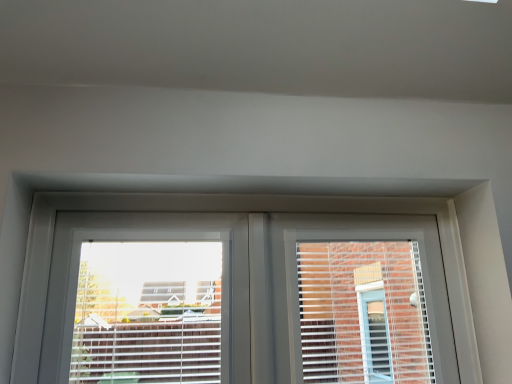
Image resolution: width=512 pixels, height=384 pixels. What do you see at coordinates (247, 299) in the screenshot?
I see `white plastic window at center` at bounding box center [247, 299].

Where is `white plastic window at center`? The image size is (512, 384). white plastic window at center is located at coordinates (247, 299).

Locate an element on the screen. This screenshot has width=512, height=384. white plastic window at center is located at coordinates (247, 299).